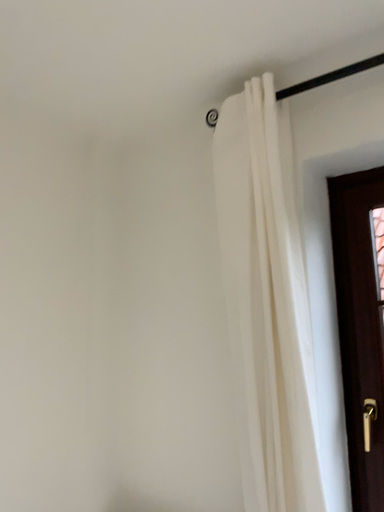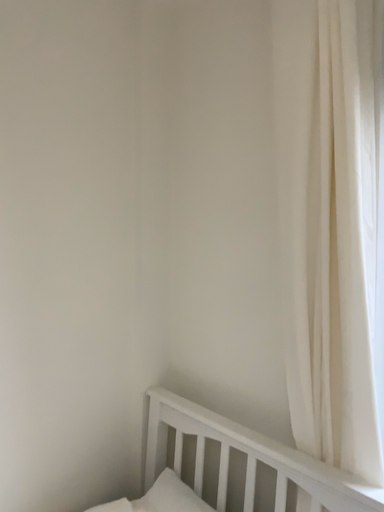
Question: Which way did the camera rotate in the video?

Choices:
 (A) rotated left
 (B) rotated right

Answer: (A)